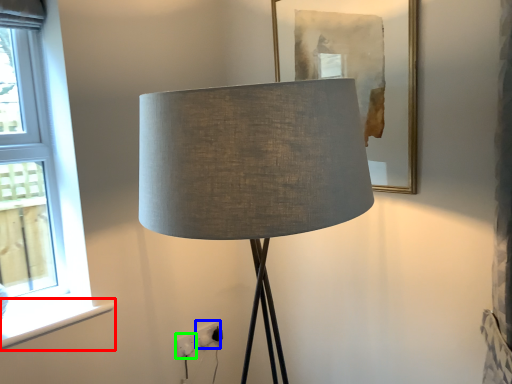
Question: Considering the real-world distances, which object is farthest from window sill (highlighted by a red box)? electric outlet (highlighted by a blue box) or electric outlet (highlighted by a green box)?

Choices:
 (A) electric outlet
 (B) electric outlet

Answer: (A)